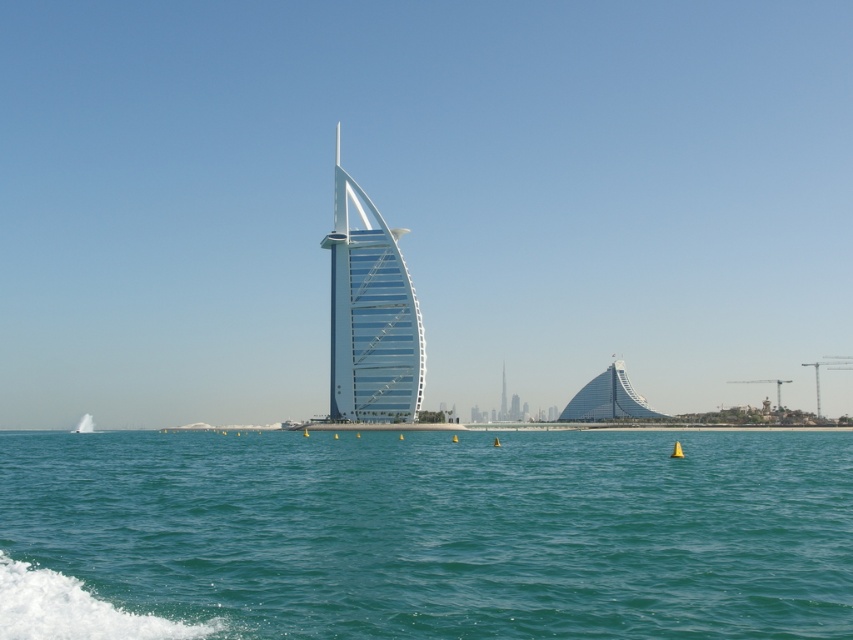
Question: Which object is closer to the camera taking this photo?

Choices:
 (A) clear blue water at center
 (B) transparent glass sail at center

Answer: (A)

Question: From the image, what is the correct spatial relationship of clear blue water at center in relation to transparent glass sail at center?

Choices:
 (A) below
 (B) above

Answer: (A)

Question: In this image, where is clear blue water at center located relative to transparent glass sail at center?

Choices:
 (A) above
 (B) below

Answer: (B)

Question: In this image, where is clear blue water at center located relative to transparent glass sail at center?

Choices:
 (A) above
 (B) below

Answer: (B)